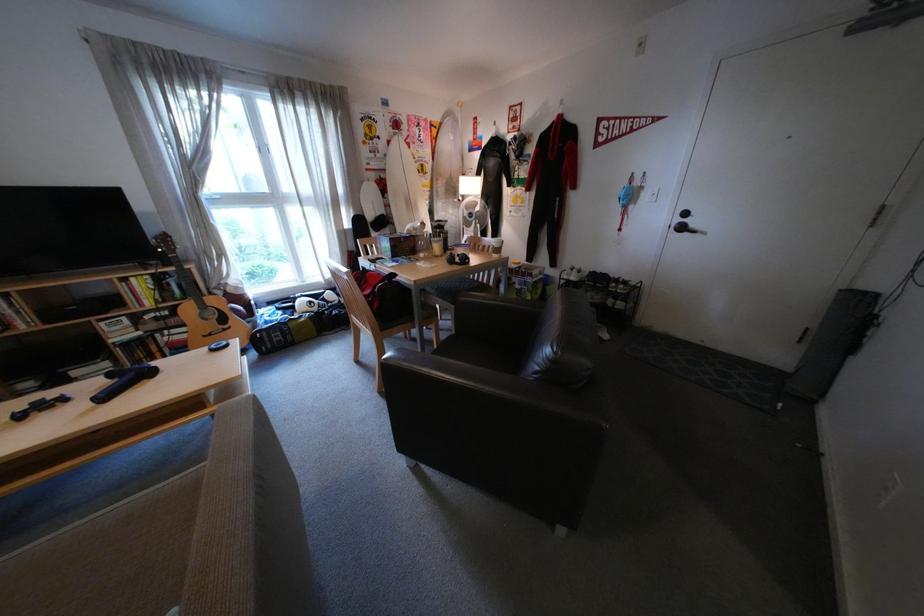
Locate an element on the screen. This screenshot has height=616, width=924. glass jar is located at coordinates (439, 233).